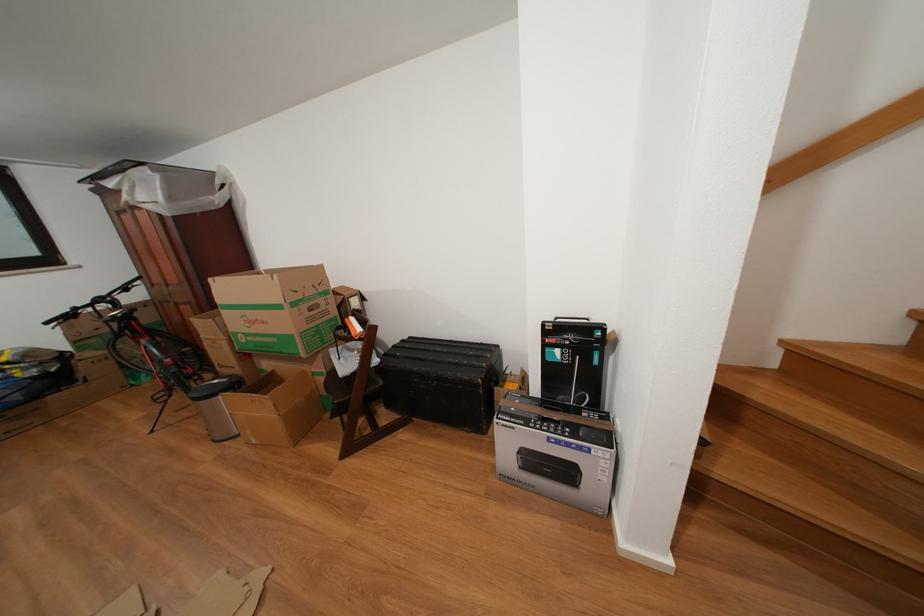
What do you see at coordinates (342, 386) in the screenshot?
I see `the stool sitting surface` at bounding box center [342, 386].